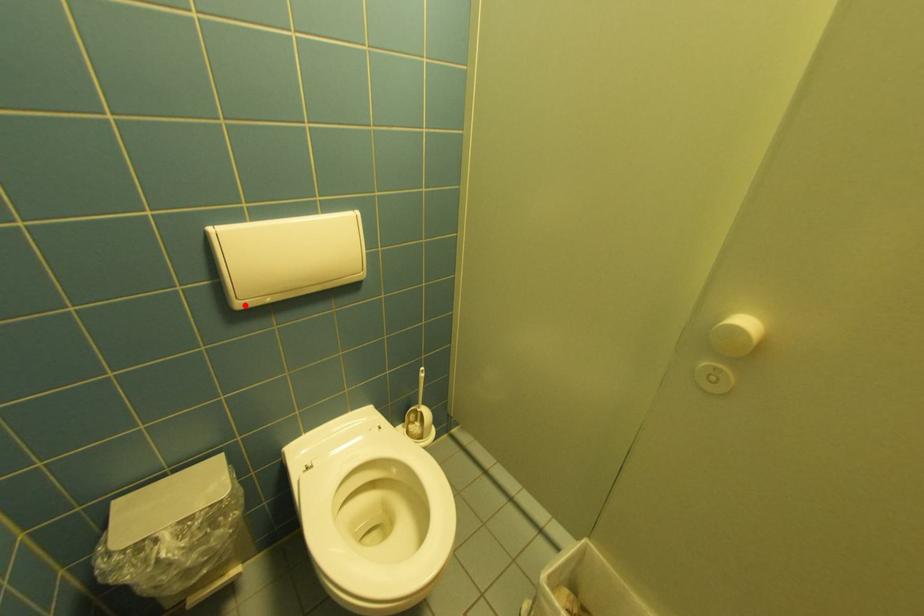
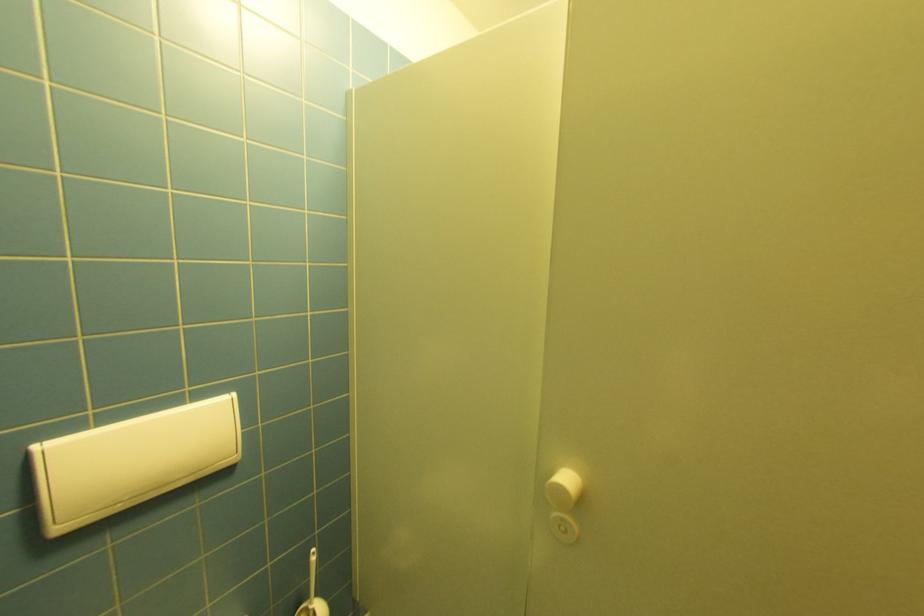
The point at the highlighted location is marked in the first image. Where is the corresponding point in the second image?

(66, 530)